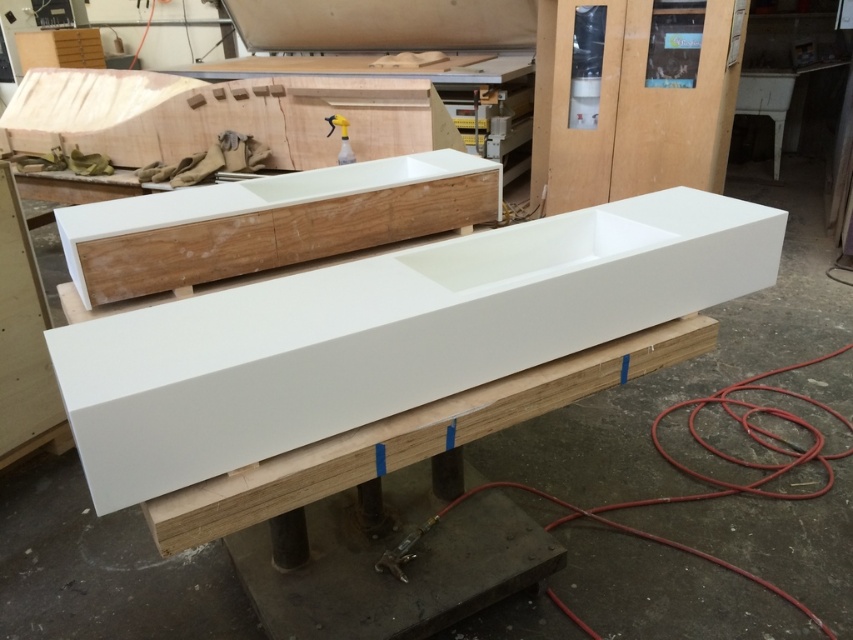
Question: Is white glossy trough at center positioned at the back of matte white plywood at center?

Choices:
 (A) no
 (B) yes

Answer: (A)

Question: Which object is farther from the camera taking this photo?

Choices:
 (A) matte white plywood at center
 (B) white glossy trough at center

Answer: (A)

Question: Is white glossy trough at center wider than matte white plywood at center?

Choices:
 (A) no
 (B) yes

Answer: (B)

Question: Can you confirm if white glossy trough at center is thinner than matte white plywood at center?

Choices:
 (A) no
 (B) yes

Answer: (A)